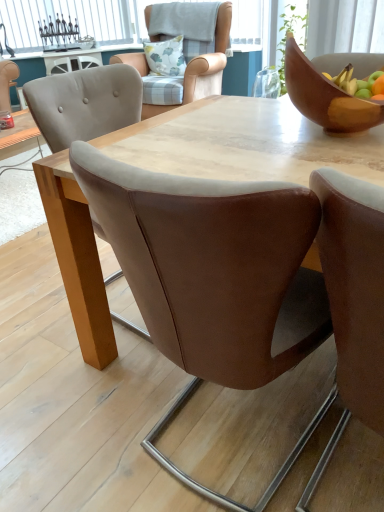
Question: Is light brown leather chair at upper center, the 1th chair positioned from the back, taller or shorter than white glass window at upper left?

Choices:
 (A) tall
 (B) short

Answer: (A)

Question: Is light brown leather chair at upper center, which is counted as the fourth chair, starting from the front, wider or thinner than white glass window at upper left?

Choices:
 (A) wide
 (B) thin

Answer: (A)

Question: Estimate the real-world distances between objects in this image. Which object is closer to the white glass window at upper left?

Choices:
 (A) fluffy cotton pillow at upper center
 (B) wooden bowl at upper right
 (C) brown leather chair at center, which is counted as the third chair, starting from the back
 (D) brown leather chair at center, arranged as the second chair when viewed from the back
 (E) light brown leather chair at upper center, which is counted as the fourth chair, starting from the front

Answer: (E)

Question: Estimate the real-world distances between objects in this image. Which object is farther from the brown leather chair at center, which ranks as the 2th chair in front-to-back order?

Choices:
 (A) fluffy cotton pillow at upper center
 (B) light brown leather chair at upper center, which is counted as the fourth chair, starting from the front
 (C) brown leather chair at center, arranged as the second chair when viewed from the back
 (D) white glass window at upper left
 (E) wooden bowl at upper right

Answer: (D)